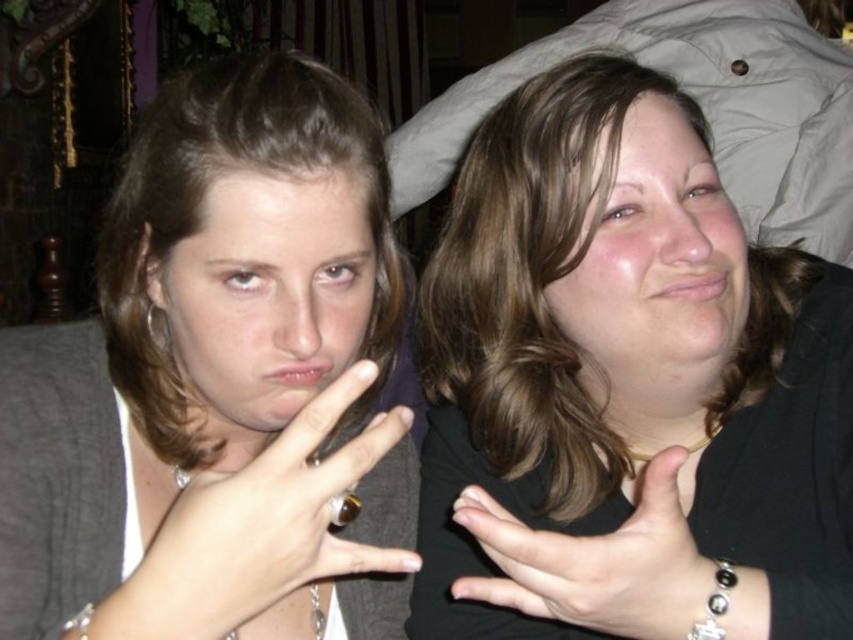
Can you confirm if smooth skin hand at center is wider than silver metallic earring at upper left?

Yes.

Is point (463, 582) less distant than point (155, 308)?

That is True.

Is point (544, 566) positioned in front of point (155, 323)?

Yes, point (544, 566) is in front of point (155, 323).

In order to click on smooth skin hand at center in this screenshot , I will do `click(596, 561)`.

Does matte black ring at center have a smaller size compared to smooth skin hand at center?

No.

At what (x,y) coordinates should I click in order to perform the action: click on matte black ring at center. Please return your answer as a coordinate pair (x, y). Looking at the image, I should click on (218, 385).

Between point (318, 355) and point (664, 528), which one is positioned in front?

Point (664, 528) is in front.

What are the coordinates of `matte black ring at center` in the screenshot? It's located at (218, 385).

Does matte black ring at center appear on the right side of silver metallic earring at upper left?

Indeed, matte black ring at center is positioned on the right side of silver metallic earring at upper left.

Between point (369, 524) and point (154, 314), which one is positioned behind?

The point (369, 524) is more distant.

Locate an element on the screen. matte black ring at center is located at coordinates (218, 385).